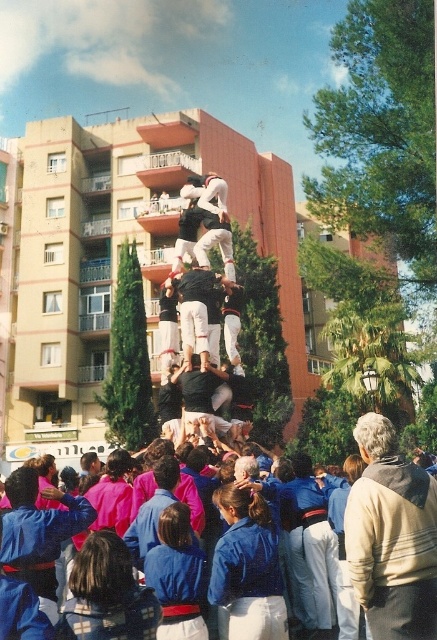
Question: Which point is farther to the camera?

Choices:
 (A) tap(373, 417)
 (B) tap(188, 314)

Answer: (B)

Question: Does beige sweater at center appear on the right side of dark brown leather pants at center?

Choices:
 (A) no
 (B) yes

Answer: (B)

Question: Can you confirm if beige sweater at center is positioned to the left of dark brown leather pants at center?

Choices:
 (A) yes
 (B) no

Answer: (B)

Question: Is beige sweater at center thinner than dark brown leather pants at center?

Choices:
 (A) yes
 (B) no

Answer: (B)

Question: Which object is farther from the camera taking this photo?

Choices:
 (A) dark brown leather pants at center
 (B) beige sweater at center

Answer: (A)